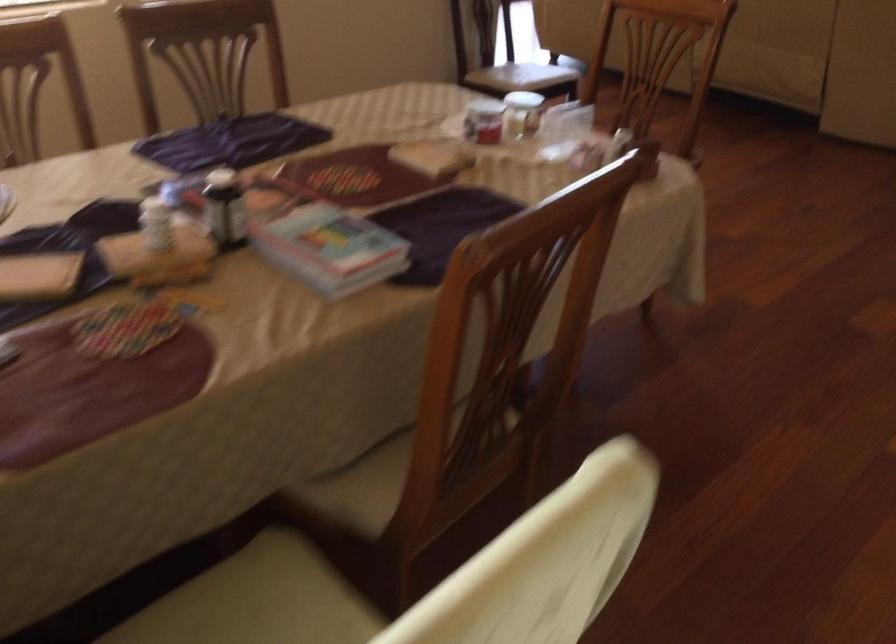
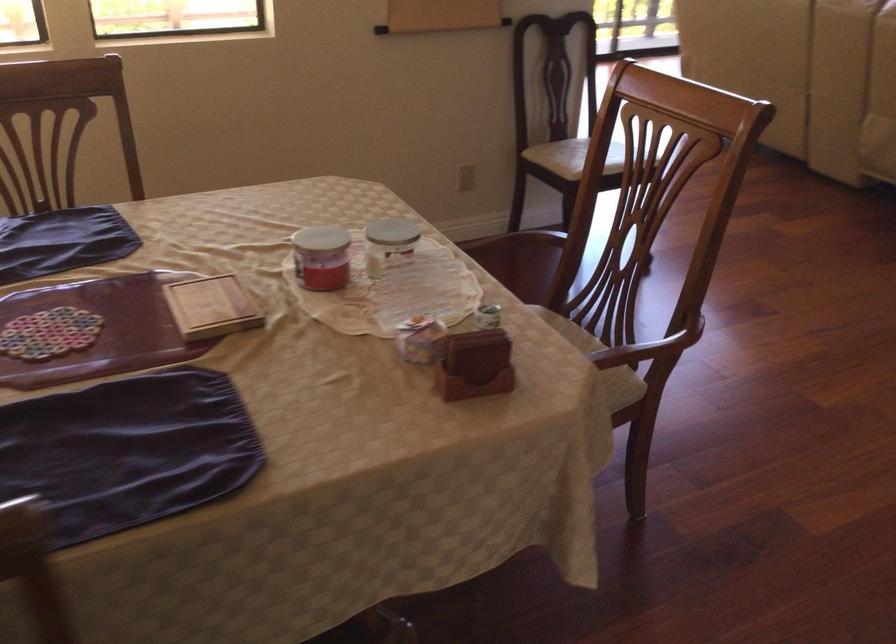
Which direction would the cameraman need to move to produce the second image?

The cameraman moved toward right, forward.